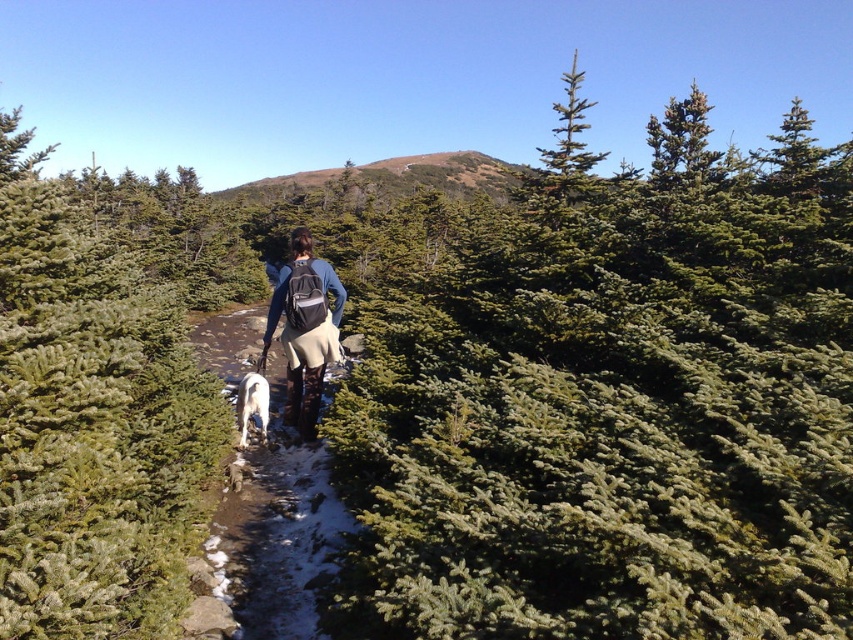
Which is below, green needle-like trees at center or brown grassy hillside at center?

Positioned lower is green needle-like trees at center.

Who is taller, green needle-like trees at center or brown grassy hillside at center?

brown grassy hillside at center

Does point (132, 513) come in front of point (299, 177)?

Yes, point (132, 513) is in front of point (299, 177).

Locate an element on the screen. This screenshot has width=853, height=640. green needle-like trees at center is located at coordinates (91, 422).

Between brown grassy hillside at center and white fluffy dog at center, which one is positioned higher?

brown grassy hillside at center is higher up.

Can you confirm if brown grassy hillside at center is positioned below white fluffy dog at center?

Incorrect, brown grassy hillside at center is not positioned below white fluffy dog at center.

The image size is (853, 640). Describe the element at coordinates (393, 177) in the screenshot. I see `brown grassy hillside at center` at that location.

Identify the location of brown grassy hillside at center. The image size is (853, 640). (393, 177).

Does matte black backpack at center have a lesser height compared to brown grassy hillside at center?

Indeed, matte black backpack at center has a lesser height compared to brown grassy hillside at center.

Consider the image. Can you confirm if matte black backpack at center is positioned to the left of brown grassy hillside at center?

In fact, matte black backpack at center is to the right of brown grassy hillside at center.

Where is `matte black backpack at center`? matte black backpack at center is located at coordinates (305, 330).